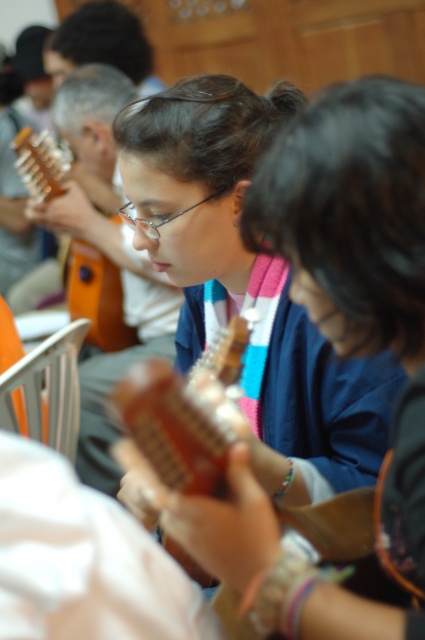
Does wooden acoustic guitar at center have a lesser height compared to matte brown guitar at left?

Yes.

Does wooden acoustic guitar at center have a larger size compared to matte brown guitar at left?

Incorrect, wooden acoustic guitar at center is not larger than matte brown guitar at left.

Does point (175, 374) come behind point (113, 337)?

That is False.

This screenshot has height=640, width=425. In order to click on wooden acoustic guitar at center in this screenshot , I will do `click(172, 429)`.